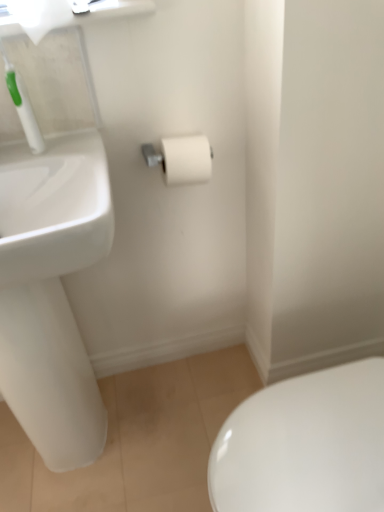
Question: Considering the relative sizes of white matte toilet paper at center, which is the first toilet paper in bottom-to-top order, and white glossy sink at left in the image provided, is white matte toilet paper at center, which is the first toilet paper in bottom-to-top order, wider than white glossy sink at left?

Choices:
 (A) no
 (B) yes

Answer: (A)

Question: Is white glossy sink at left a part of white matte toilet paper at center, the 2th toilet paper in the front-to-back sequence?

Choices:
 (A) yes
 (B) no

Answer: (B)

Question: Considering the relative positions of white matte toilet paper at center, arranged as the second toilet paper when viewed from the top, and white glossy sink at left in the image provided, is white matte toilet paper at center, arranged as the second toilet paper when viewed from the top, to the right of white glossy sink at left from the viewer's perspective?

Choices:
 (A) yes
 (B) no

Answer: (A)

Question: Is white glossy sink at left at the back of white matte toilet paper at center, which is the first toilet paper in bottom-to-top order?

Choices:
 (A) no
 (B) yes

Answer: (A)

Question: Considering the relative sizes of white matte toilet paper at center, arranged as the second toilet paper when viewed from the top, and white glossy sink at left in the image provided, is white matte toilet paper at center, arranged as the second toilet paper when viewed from the top, shorter than white glossy sink at left?

Choices:
 (A) no
 (B) yes

Answer: (B)

Question: In the image, is white plastic toothbrush at upper left positioned in front of or behind white glossy sink at left?

Choices:
 (A) front
 (B) behind

Answer: (B)

Question: Considering the positions of white plastic toothbrush at upper left and white glossy sink at left in the image, is white plastic toothbrush at upper left bigger or smaller than white glossy sink at left?

Choices:
 (A) big
 (B) small

Answer: (B)

Question: Considering the positions of white plastic toothbrush at upper left and white glossy sink at left in the image, is white plastic toothbrush at upper left wider or thinner than white glossy sink at left?

Choices:
 (A) wide
 (B) thin

Answer: (B)

Question: Is white plastic toothbrush at upper left taller or shorter than white glossy sink at left?

Choices:
 (A) tall
 (B) short

Answer: (B)

Question: Do you think white glossy sink at left is within white matte toilet paper at center, the 2th toilet paper in the front-to-back sequence, or outside of it?

Choices:
 (A) outside
 (B) inside

Answer: (A)

Question: Does point (61, 382) appear closer or farther from the camera than point (190, 148)?

Choices:
 (A) farther
 (B) closer

Answer: (A)

Question: Looking at their shapes, would you say white glossy sink at left is wider or thinner than white matte toilet paper at center, the 2th toilet paper in the front-to-back sequence?

Choices:
 (A) wide
 (B) thin

Answer: (A)

Question: From a real-world perspective, relative to white matte toilet paper at center, arranged as the second toilet paper when viewed from the top, is white glossy sink at left vertically above or below?

Choices:
 (A) below
 (B) above

Answer: (A)

Question: Considering the positions of white matte toilet paper at upper left, the 1th toilet paper in the top-to-bottom sequence, and white plastic toothbrush at upper left in the image, is white matte toilet paper at upper left, the 1th toilet paper in the top-to-bottom sequence, taller or shorter than white plastic toothbrush at upper left?

Choices:
 (A) short
 (B) tall

Answer: (A)

Question: From a real-world perspective, is white matte toilet paper at upper left, which appears as the 2th toilet paper when ordered from the bottom, positioned above or below white plastic toothbrush at upper left?

Choices:
 (A) below
 (B) above

Answer: (B)